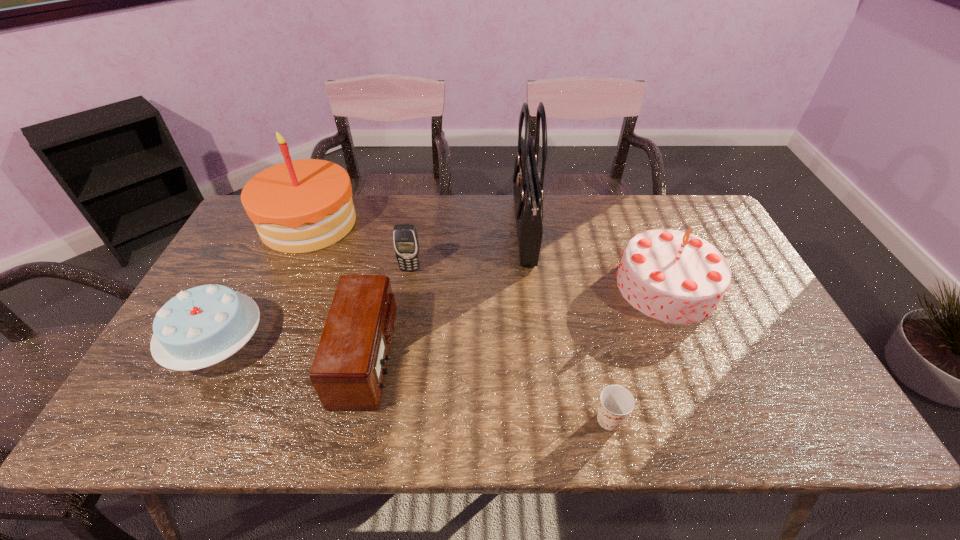
Locate an element on the screen. birthday cake identified as the second closest to the shortest birthday cake is located at coordinates (676, 277).

Locate an element on the screen. This screenshot has width=960, height=540. free space that satisfies the following two spatial constraints: 1. on the front side of the shortest object; 2. on the right side of the shortest birthday cake is located at coordinates (178, 419).

At what (x,y) coordinates should I click in order to perform the action: click on vacant space that satisfies the following two spatial constraints: 1. on the back side of the second tallest object; 2. on the left side of the shortest birthday cake. Please return your answer as a coordinate pair (x, y). The height and width of the screenshot is (540, 960). Looking at the image, I should click on (279, 223).

At what (x,y) coordinates should I click in order to perform the action: click on free space that satisfies the following two spatial constraints: 1. on the back side of the second shortest birthday cake; 2. with an open clasp on the front of the tallest object. Please return your answer as a coordinate pair (x, y). Looking at the image, I should click on (644, 231).

Where is `free spot that satisfies the following two spatial constraints: 1. with an open clasp on the front of the tallest object; 2. on the right side of the second object from right to left`? This screenshot has width=960, height=540. free spot that satisfies the following two spatial constraints: 1. with an open clasp on the front of the tallest object; 2. on the right side of the second object from right to left is located at coordinates (545, 419).